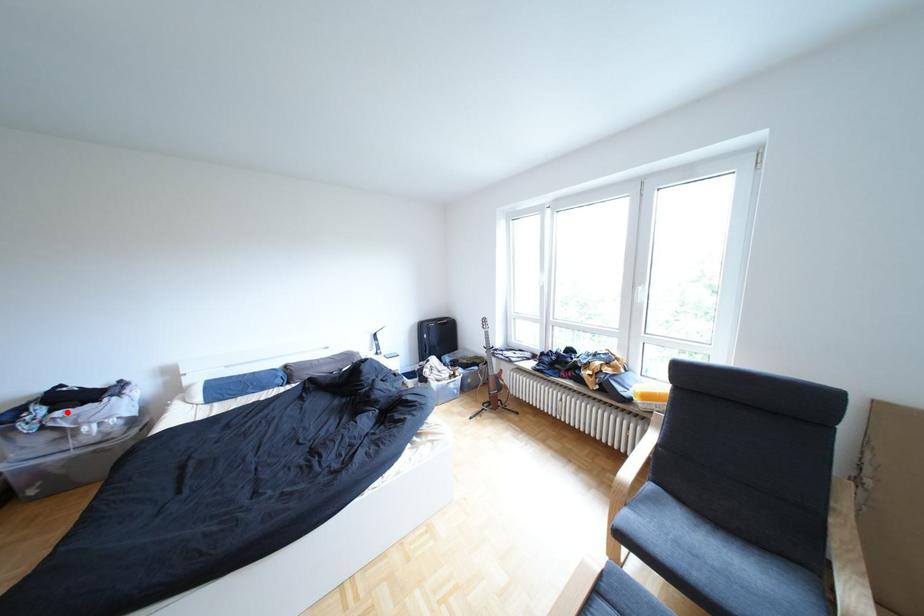
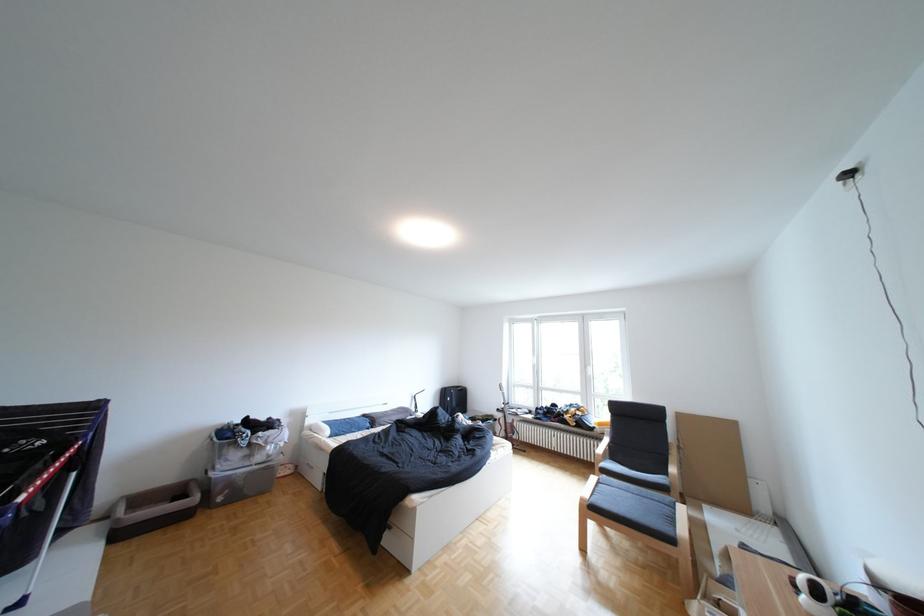
Question: I am providing you with two images of the same scene from different viewpoints. A red point is marked on the first image. Can you still see the location of the red point in image 2?

Choices:
 (A) Yes
 (B) No

Answer: (A)